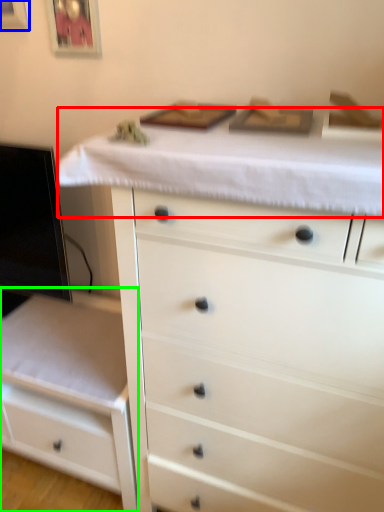
Question: Based on their relative distances, which object is farther from counter top (highlighted by a red box)? Choose from picture frame (highlighted by a blue box) and chest of drawers (highlighted by a green box).

Choices:
 (A) picture frame
 (B) chest of drawers

Answer: (A)